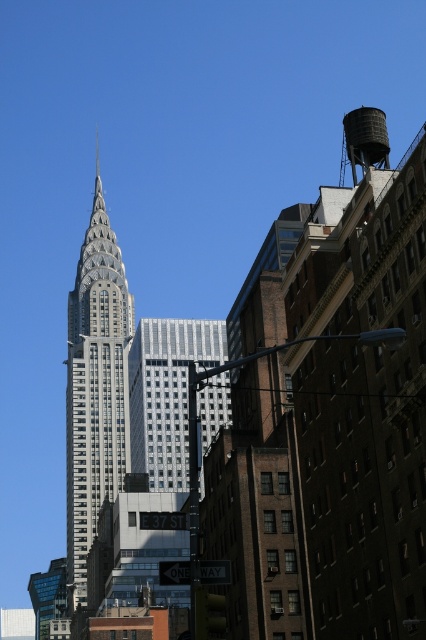
You are a city planner analyzing the skyline. You notice the silver glass building at center and the matte gray water tower at upper right. Which structure appears larger in the scene?

The silver glass building at center is smaller than the matte gray water tower at upper right, so the matte gray water tower at upper right appears larger.

You are an architect analyzing the urban layout. Given the Chrysler Building on the left and the older brick buildings on the right, how does the width of the gray stone tower at center compare to the silver glass building at center?

The gray stone tower at center is wider than the silver glass building at center.